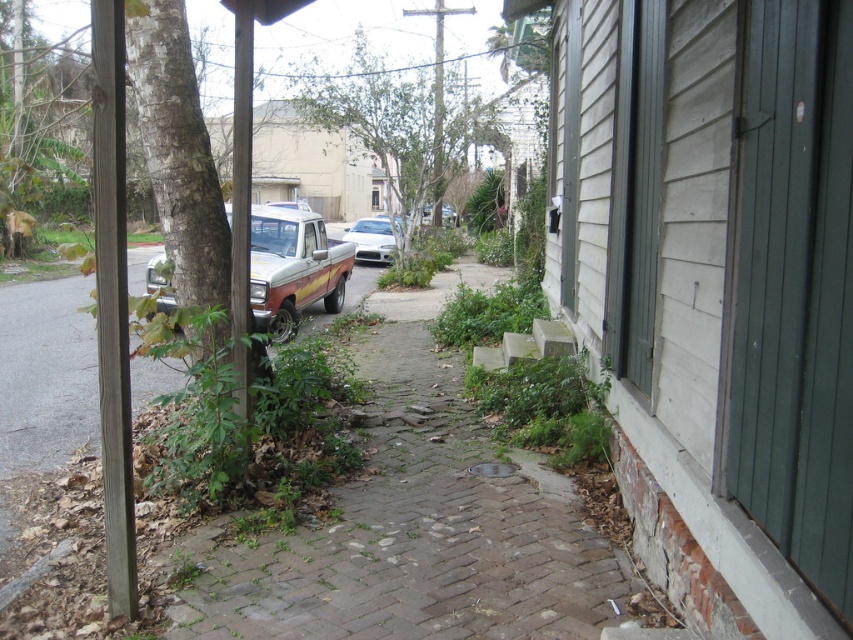
You are standing at the origin point of the image. Which direction should you move to reach the brick paved path at center?

The brick paved path at center is located at coordinates point (x=419, y=524), so you should move towards the right and forward to reach it.

You are a delivery person trying to park your van between the green leafy tree at center and the white glossy sedan at center. Can you fit your van there if it requires 2 meters of space?

The green leafy tree at center is much taller than the white glossy sedan at center, but the distance between them isn generated in the description. Therefore, it is impossible to determine if there is enough space for your van.